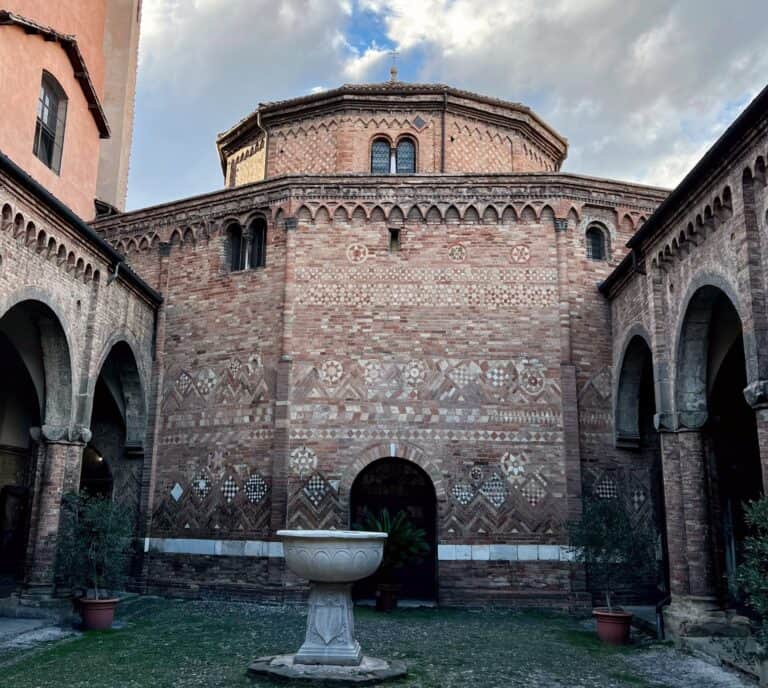
Find the location of `small square window`. small square window is located at coordinates (396, 236).